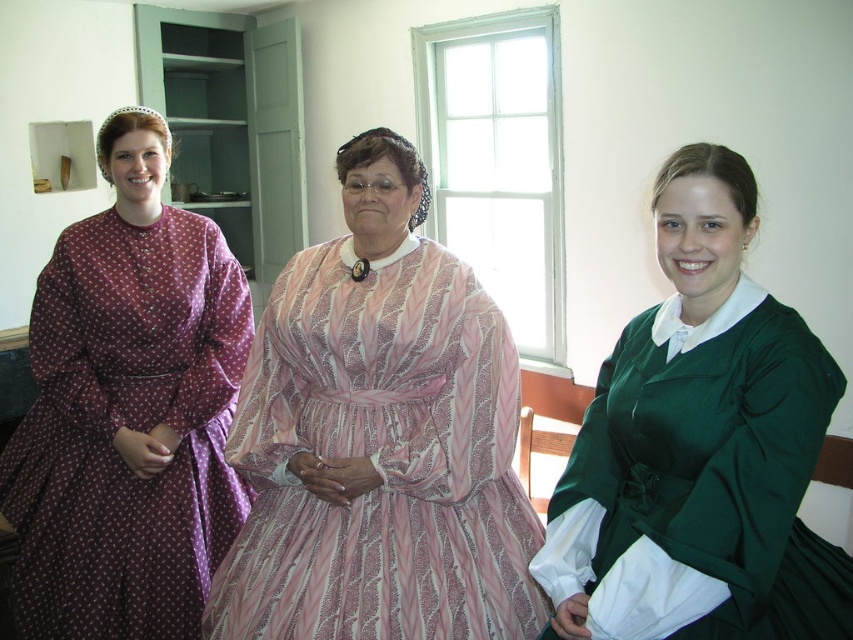
Question: Is pink satin dress at center to the right of green satin dress at center from the viewer's perspective?

Choices:
 (A) no
 (B) yes

Answer: (A)

Question: Based on their relative distances, which object is nearer to the green satin dress at center?

Choices:
 (A) pink satin dress at center
 (B) purple printed dress at left

Answer: (A)

Question: Based on their relative distances, which object is farther from the purple printed dress at left?

Choices:
 (A) pink satin dress at center
 (B) green satin dress at center

Answer: (B)

Question: Based on their relative distances, which object is nearer to the pink satin dress at center?

Choices:
 (A) purple printed dress at left
 (B) green satin dress at center

Answer: (B)

Question: Is pink satin dress at center wider than purple printed dress at left?

Choices:
 (A) yes
 (B) no

Answer: (A)

Question: Does pink satin dress at center come in front of green satin dress at center?

Choices:
 (A) no
 (B) yes

Answer: (A)